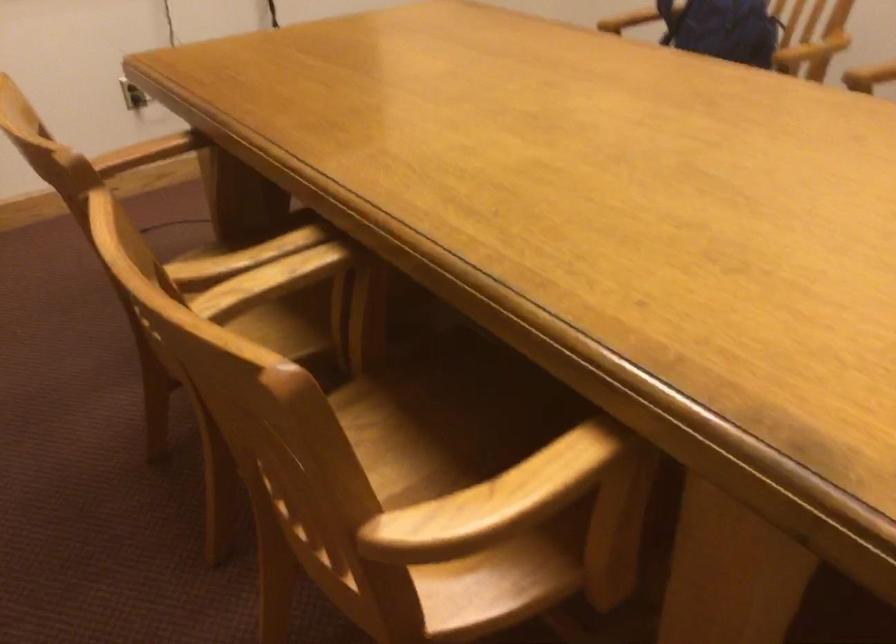
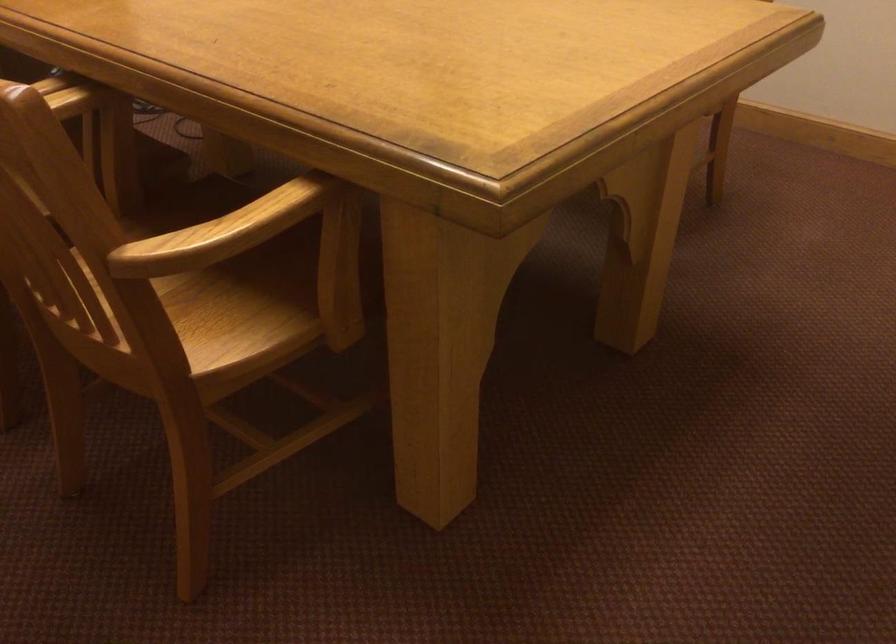
Question: The camera is either moving clockwise (left) or counter-clockwise (right) around the object. The first image is from the beginning of the video and the second image is from the end. Is the camera moving left or right when shooting the video?

Choices:
 (A) Left
 (B) Right

Answer: (A)